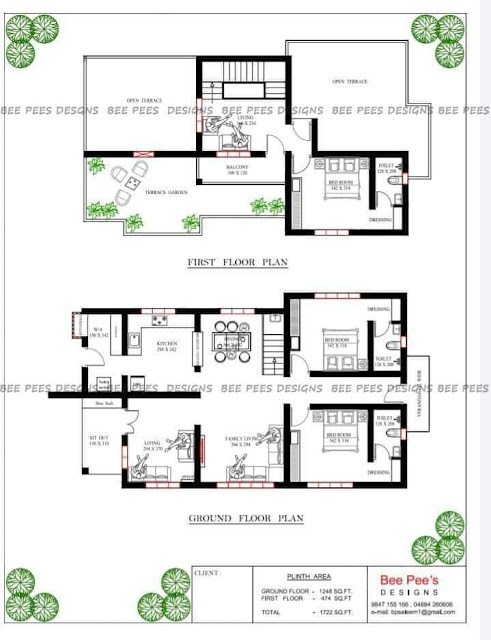
The width and height of the screenshot is (491, 640). In order to click on toilets in this screenshot , I will do `click(397, 180)`, `click(394, 432)`, `click(394, 342)`.